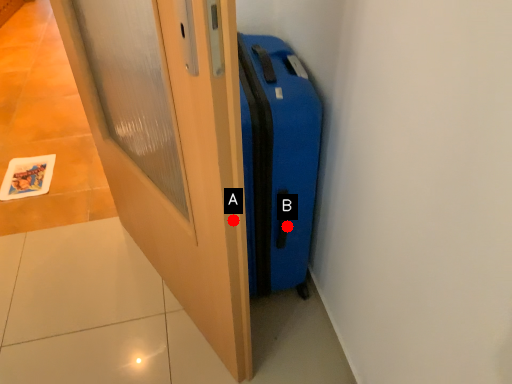
Question: Two points are circled on the image, labeled by A and B beside each circle. Which of the following is the closest to the observer?

Choices:
 (A) A is closer
 (B) B is closer

Answer: (A)